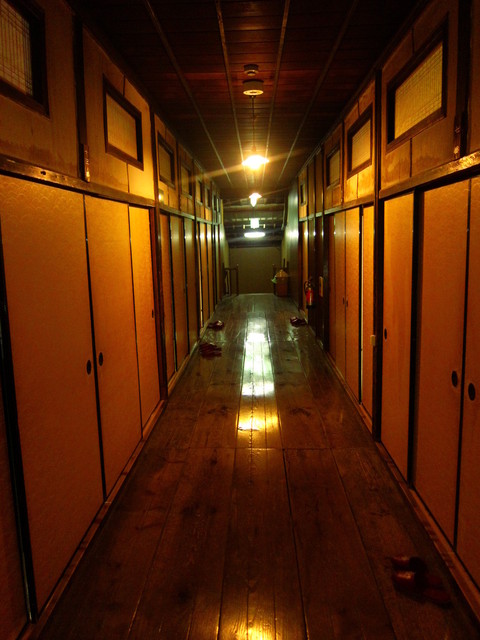
Image resolution: width=480 pixels, height=640 pixels. Identify the location of doors. (88, 370), (104, 353), (445, 381), (474, 408), (393, 332), (350, 308), (339, 299), (181, 292), (190, 281).